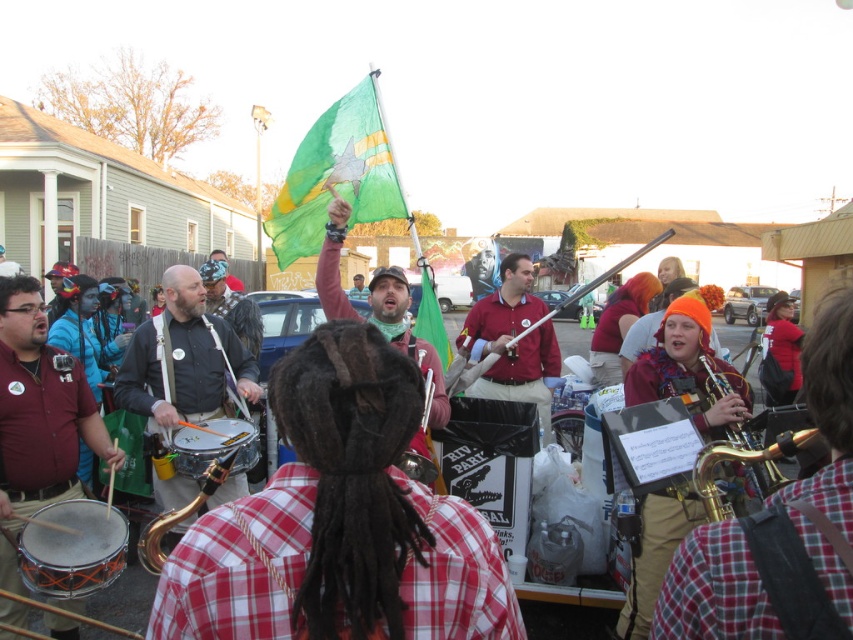
Question: Is shiny silver drum at center thinner than gold brass saxophone at center?

Choices:
 (A) yes
 (B) no

Answer: (A)

Question: Which of the following is the closest to the observer?

Choices:
 (A) (140, 561)
 (B) (248, 436)

Answer: (B)

Question: Estimate the real-world distances between objects in this image. Which object is closer to the matte green flag at center?

Choices:
 (A) gold brass saxophone at lower right
 (B) gold brass saxophone at center
 (C) green fabric flag at upper center
 (D) shiny black drum at center

Answer: (C)

Question: Does maroon fabric shirt at left appear on the right side of shiny silver drum at center?

Choices:
 (A) yes
 (B) no

Answer: (B)

Question: Can you confirm if maroon shirt at center is thinner than gold brass saxophone at lower right?

Choices:
 (A) no
 (B) yes

Answer: (A)

Question: Considering the real-world distances, which object is closest to the gold brass saxophone at center?

Choices:
 (A) shiny black drum at center
 (B) green fabric flag at upper center

Answer: (A)